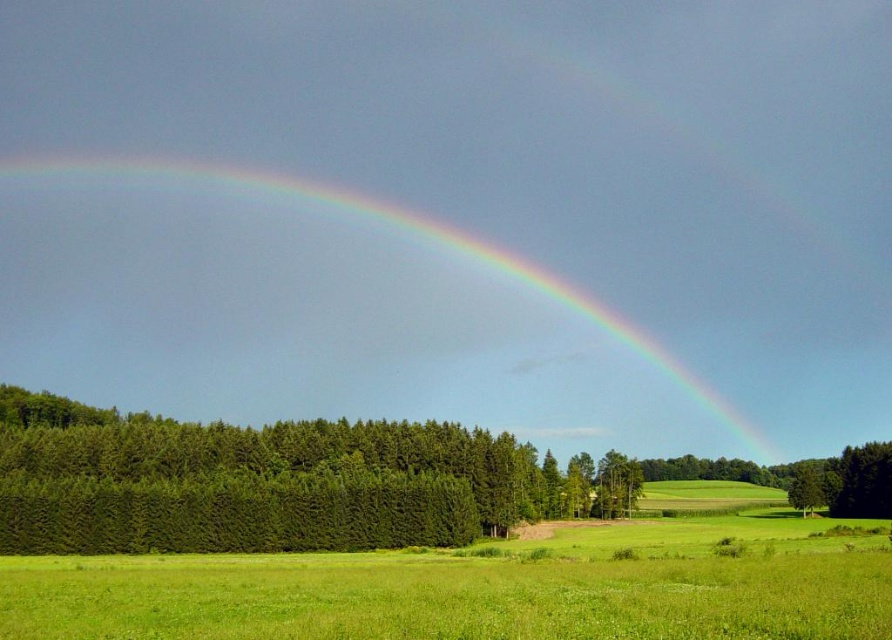
Question: Among these points, which one is nearest to the camera?

Choices:
 (A) (246, 440)
 (B) (832, 477)

Answer: (A)

Question: Among these points, which one is nearest to the camera?

Choices:
 (A) (885, 449)
 (B) (787, 490)
 (C) (554, 426)

Answer: (A)

Question: Can you confirm if rainbow at upper center is smaller than green matte tree at lower right?

Choices:
 (A) yes
 (B) no

Answer: (B)

Question: Estimate the real-world distances between objects in this image. Which object is closer to the green leafy tree at center?

Choices:
 (A) rainbow at upper center
 (B) green textured trees at left
 (C) green matte tree at lower right

Answer: (C)

Question: Where is green textured trees at left located in relation to green leafy tree at center in the image?

Choices:
 (A) right
 (B) left

Answer: (B)

Question: Is the position of rainbow at upper center less distant than that of green matte tree at lower right?

Choices:
 (A) no
 (B) yes

Answer: (A)